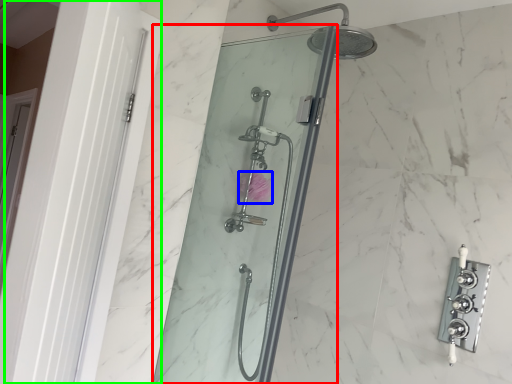
Question: Which is nearer to the shower door (highlighted by a red box)? flower (highlighted by a blue box) or screen door (highlighted by a green box).

Choices:
 (A) flower
 (B) screen door

Answer: (A)